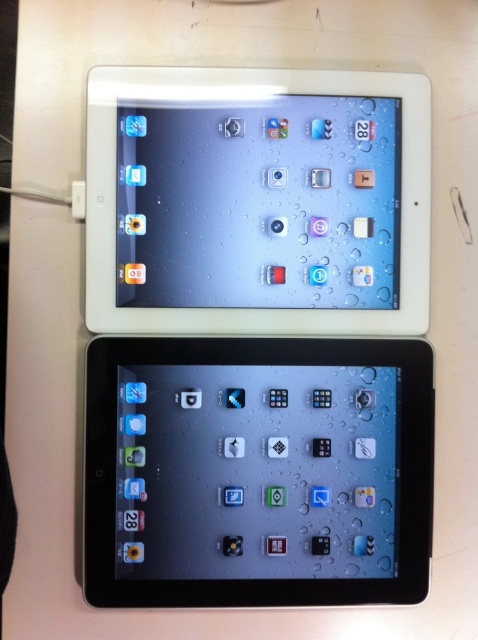
Between point (138, 484) and point (223, 129), which one is positioned in front?

Point (138, 484) is more forward.

You are a GUI agent. You are given a task and a screenshot of the screen. Output one action in this format:
    pyautogui.click(x=<x>, y=<y>)
    Task: Click on the black plastic tablet at center
    This screenshot has width=478, height=640.
    Given the screenshot: What is the action you would take?
    pyautogui.click(x=258, y=472)